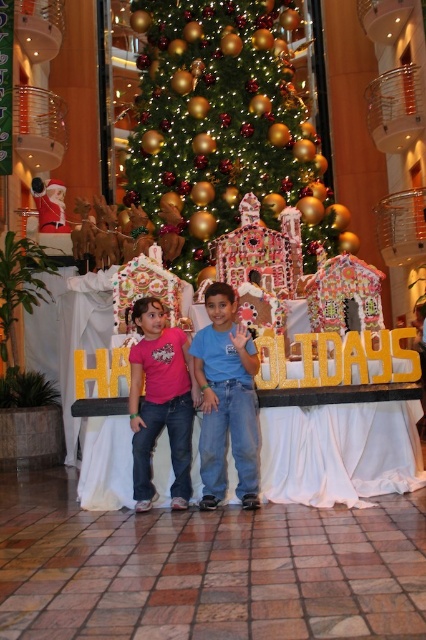
Can you confirm if green shiny christmas tree at center is wider than pink matte shirt at center?

Indeed, green shiny christmas tree at center has a greater width compared to pink matte shirt at center.

Does point (209, 51) come behind point (158, 380)?

Yes, point (209, 51) is behind point (158, 380).

This screenshot has height=640, width=426. Find the location of `green shiny christmas tree at center`. green shiny christmas tree at center is located at coordinates (222, 124).

Who is positioned more to the right, green shiny christmas tree at center or blue jeans at center?

Positioned to the right is green shiny christmas tree at center.

Can you confirm if green shiny christmas tree at center is wider than blue jeans at center?

Indeed, green shiny christmas tree at center has a greater width compared to blue jeans at center.

Who is more distant from viewer, (x=212, y=221) or (x=198, y=349)?

The point (x=212, y=221) is behind.

In order to click on green shiny christmas tree at center in this screenshot , I will do `click(222, 124)`.

Is blue jeans at center further to camera compared to pink matte shirt at center?

No, it is in front of pink matte shirt at center.

Is blue jeans at center to the right of pink matte shirt at center from the viewer's perspective?

Indeed, blue jeans at center is positioned on the right side of pink matte shirt at center.

Is point (207, 344) behind point (147, 506)?

Yes, it is.

Where is `blue jeans at center`? The height and width of the screenshot is (640, 426). blue jeans at center is located at coordinates (227, 401).